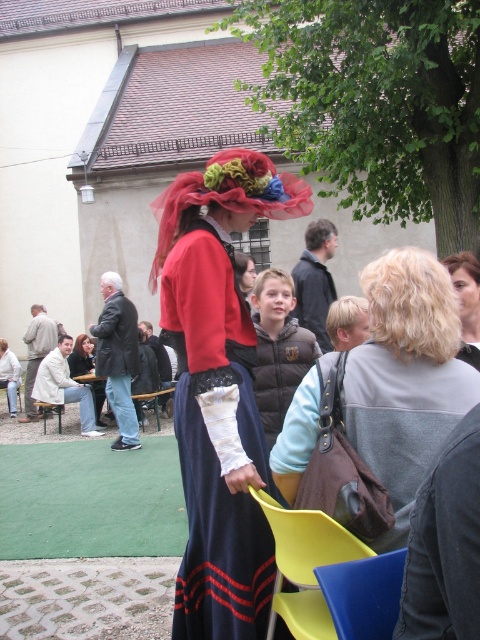
You are standing in the courtyard and see the brown leather jacket at center and the yellow plastic chair at lower center. Which object is closer to you?

The brown leather jacket at center is closer to you because it is in front of the yellow plastic chair at lower center.